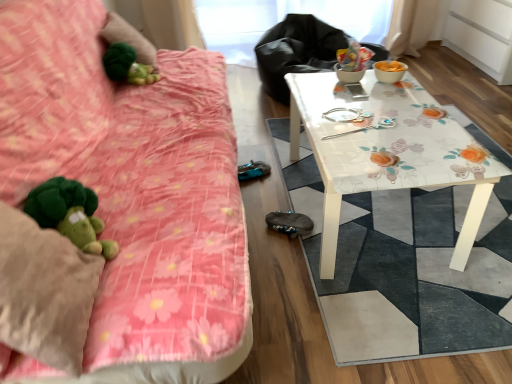
Question: Is green plush at upper left inside the boundaries of floral glass table at center, or outside?

Choices:
 (A) outside
 (B) inside

Answer: (A)

Question: From the image's perspective, is green plush at upper left above or below floral glass table at center?

Choices:
 (A) below
 (B) above

Answer: (B)

Question: Based on their relative distances, which object is nearer to the floral-patterned table at right?

Choices:
 (A) metallic silver spoon at center
 (B) green plush at upper left
 (C) green plush toy at left, the second toy in the top-to-bottom sequence
 (D) fluffy pink blanket at left
 (E) floral glass table at center

Answer: (B)

Question: Based on their relative distances, which object is nearer to the green plush at upper left?

Choices:
 (A) green plush toy at left, arranged as the first toy when ordered from the bottom
 (B) floral glass table at center
 (C) metallic silver spoon at center
 (D) green plush toy at left, the second toy in the front-to-back sequence
 (E) floral-patterned table at right

Answer: (D)